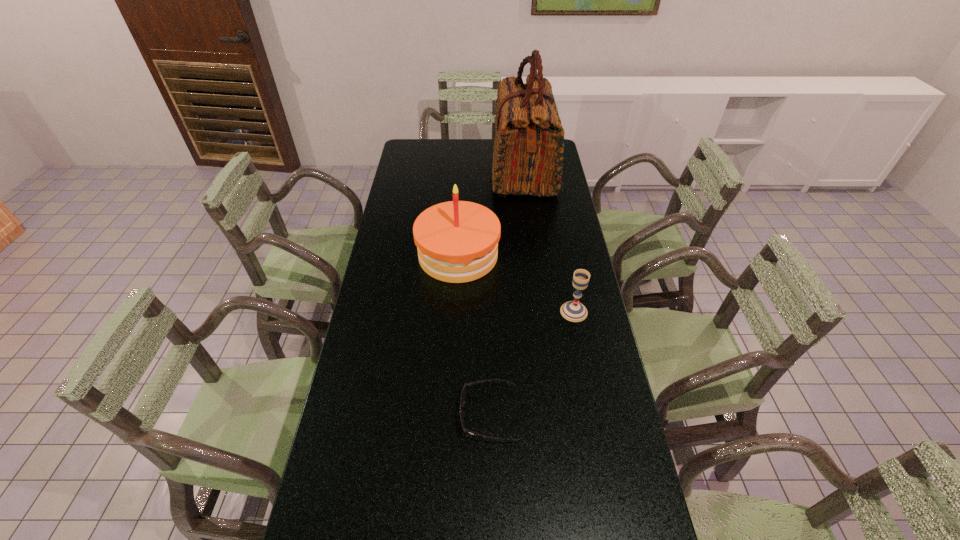
Find the location of a particular element. The width and height of the screenshot is (960, 540). vacant space located on the open handle side of the shopping bag is located at coordinates (403, 171).

The image size is (960, 540). I want to click on vacant space located on the back of the third shortest object, so click(x=463, y=173).

Locate an element on the screen. The image size is (960, 540). vacant area located on the back of the chalice is located at coordinates (562, 247).

Locate an element on the screen. This screenshot has width=960, height=540. free region located on the front-facing side of the nearest object is located at coordinates (349, 414).

Where is `vacant space located 0.130m on the front-facing side of the nearest object`? The width and height of the screenshot is (960, 540). vacant space located 0.130m on the front-facing side of the nearest object is located at coordinates (410, 414).

Find the location of a particular element. The width and height of the screenshot is (960, 540). free space located on the front-facing side of the nearest object is located at coordinates (418, 414).

In order to click on object that is at the far edge in this screenshot , I will do `click(528, 148)`.

Identify the location of object located at the left edge. (457, 241).

This screenshot has width=960, height=540. Find the location of `shopping bag present at the right edge`. shopping bag present at the right edge is located at coordinates (528, 148).

Find the location of a particular element. This screenshot has height=540, width=960. chalice at the right edge is located at coordinates (574, 311).